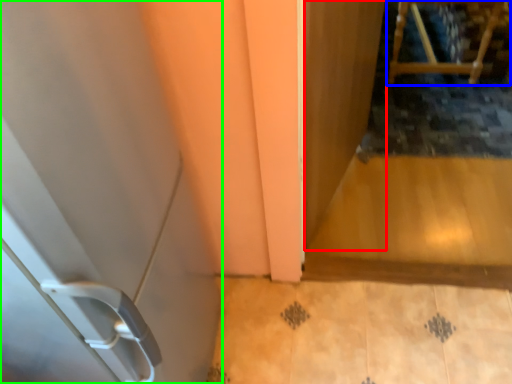
Question: Considering the real-world distances, which object is farthest from screen door (highlighted by a red box)? furniture (highlighted by a blue box) or door (highlighted by a green box)?

Choices:
 (A) furniture
 (B) door

Answer: (A)